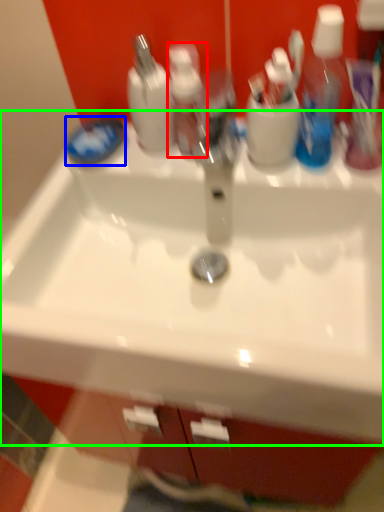
Question: Considering the real-world distances, which object is closest to toiletry (highlighted by a red box)? soap (highlighted by a blue box) or sink (highlighted by a green box).

Choices:
 (A) soap
 (B) sink

Answer: (A)